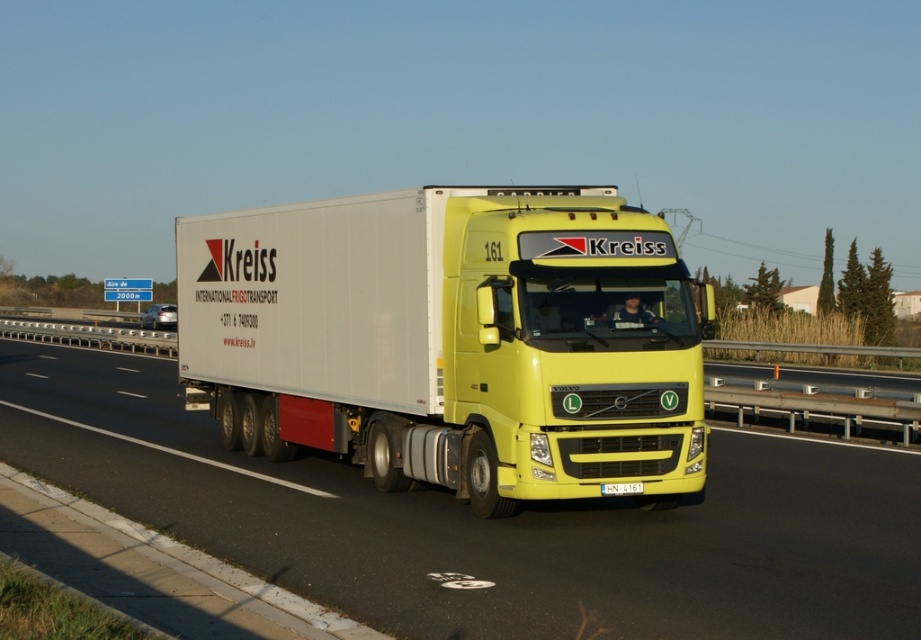
Question: Where is matte white trailer truck at center located in relation to yellow plastic license plate at center in the image?

Choices:
 (A) left
 (B) right

Answer: (B)

Question: Which object is farther from the camera taking this photo?

Choices:
 (A) yellow glossy truck at center
 (B) yellow plastic license plate at center
 (C) matte white trailer truck at center

Answer: (C)

Question: Can you confirm if matte white trailer truck at center is positioned to the left of yellow glossy truck at center?

Choices:
 (A) yes
 (B) no

Answer: (B)

Question: Which point is closer to the camera?

Choices:
 (A) (442, 556)
 (B) (614, 490)

Answer: (A)

Question: Which point is farther from the camera taking this photo?

Choices:
 (A) (616, 488)
 (B) (426, 563)

Answer: (A)

Question: Where is matte white trailer truck at center located in relation to yellow plastic license plate at center in the image?

Choices:
 (A) left
 (B) right

Answer: (B)